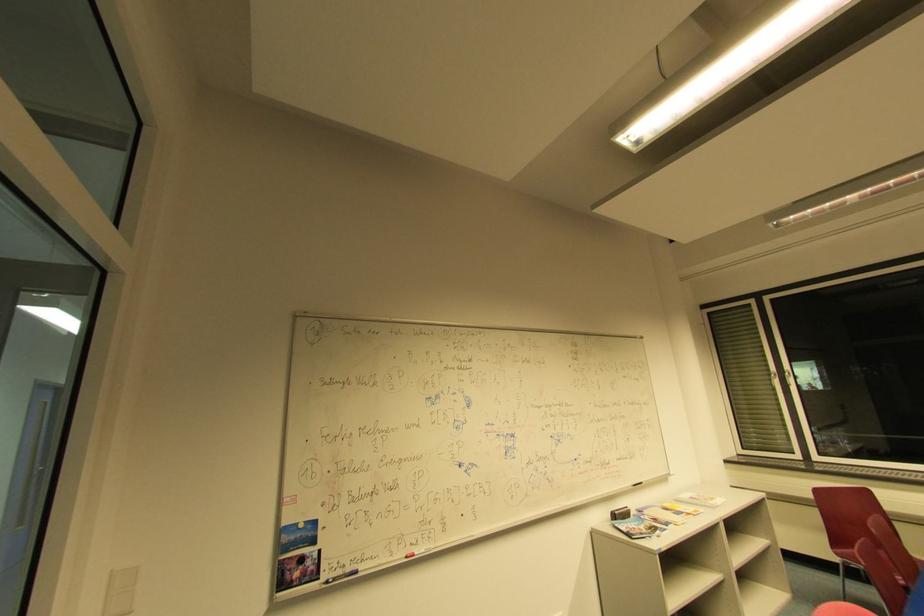
This screenshot has height=616, width=924. What do you see at coordinates (667, 513) in the screenshot?
I see `the magazine` at bounding box center [667, 513].